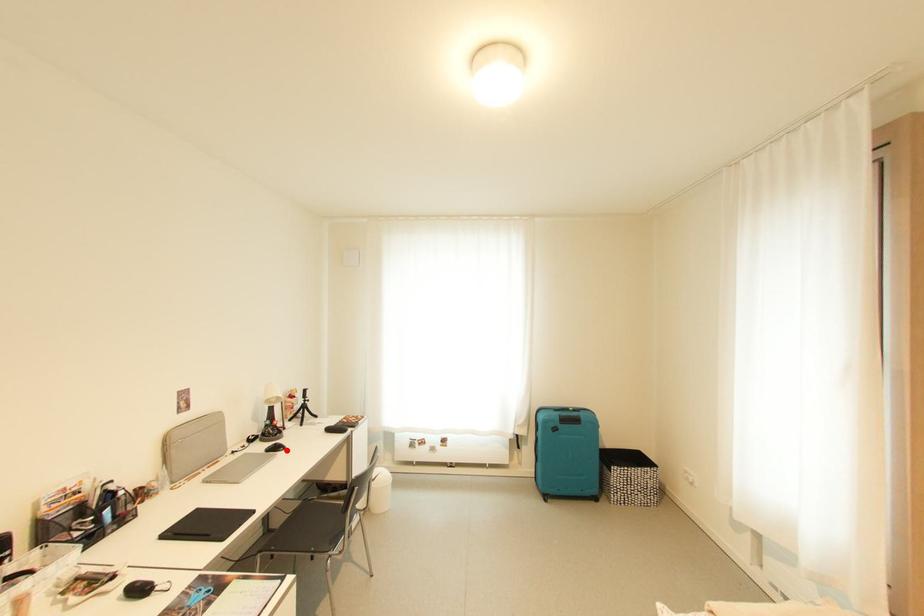
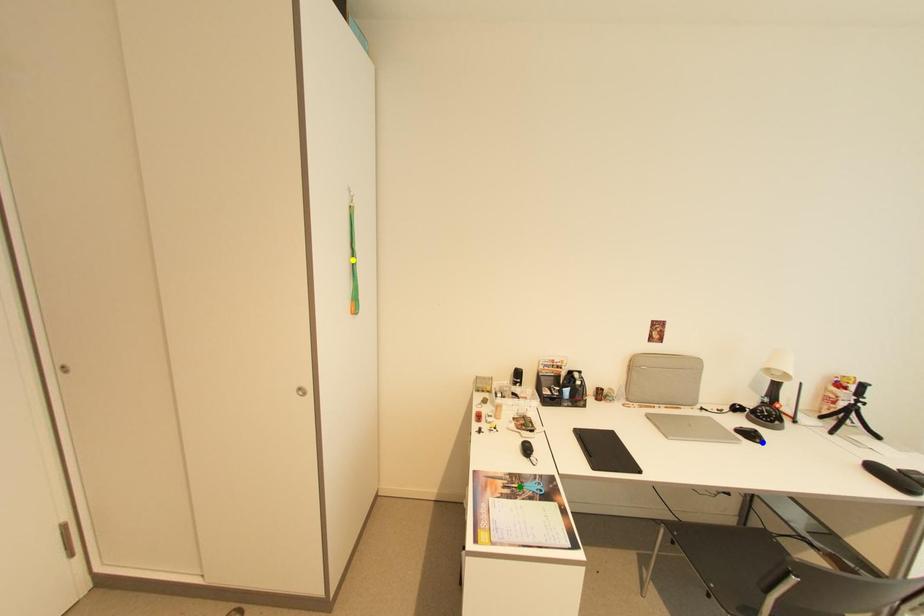
Question: I am providing you with two images of the same scene from different viewpoints. A red point is marked on the first image. You are given multiple points on the second image. Can you choose the point in image 2 that corresponds to the point in image 1?

Choices:
 (A) blue point
 (B) green point
 (C) yellow point

Answer: (A)